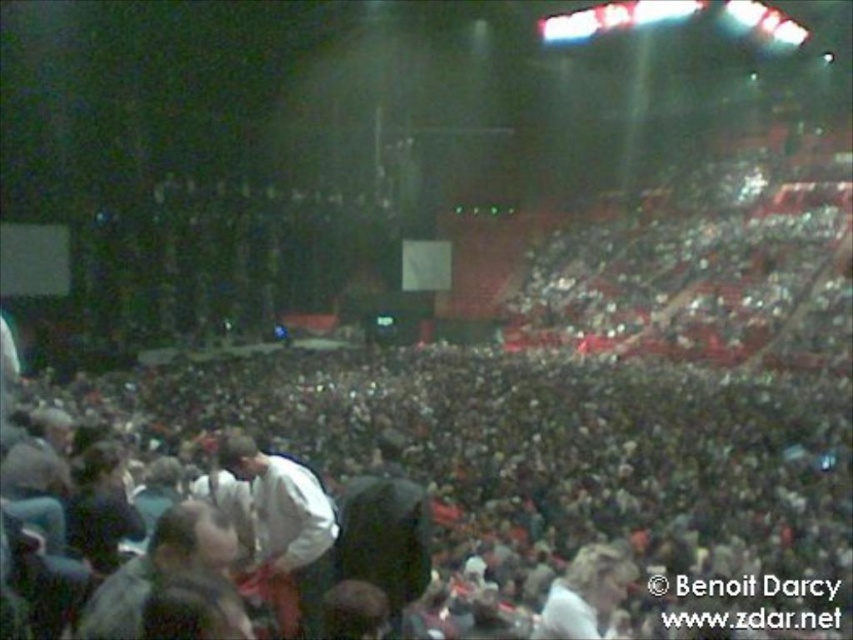
Question: Which of the following is the farthest from the observer?

Choices:
 (A) (595, 548)
 (B) (398, 605)

Answer: (A)

Question: Can you confirm if dark gray fabric jacket at center is smaller than white cotton shirt at center?

Choices:
 (A) no
 (B) yes

Answer: (A)

Question: Is white matte shirt at lower left above dark gray fabric jacket at center?

Choices:
 (A) yes
 (B) no

Answer: (A)

Question: Can you confirm if white matte shirt at lower left is positioned above dark gray fabric jacket at center?

Choices:
 (A) no
 (B) yes

Answer: (B)

Question: Among these objects, which one is farthest from the camera?

Choices:
 (A) white matte shirt at lower left
 (B) white cotton shirt at center

Answer: (B)

Question: Which of these objects is positioned closest to the dark gray fabric jacket at center?

Choices:
 (A) white cotton shirt at center
 (B) white matte shirt at lower left

Answer: (B)